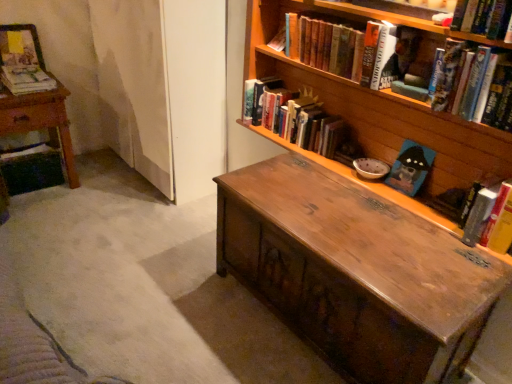
Question: Considering the positions of matte paper magazine at upper left, the 1th book from the left, and matte paper book at left, which appears as the 2th book when viewed from the left, in the image, is matte paper magazine at upper left, the 1th book from the left, bigger or smaller than matte paper book at left, which appears as the 2th book when viewed from the left,?

Choices:
 (A) big
 (B) small

Answer: (A)

Question: Does point (30, 64) appear closer or farther from the camera than point (51, 79)?

Choices:
 (A) closer
 (B) farther

Answer: (B)

Question: Based on their relative distances, which object is farther from the matte paper book at left, the 6th book when ordered from right to left?

Choices:
 (A) wooden bookcase at upper right
 (B) hardcover book at right, the seventh book in the left-to-right sequence
 (C) hardcover book at upper right, arranged as the sixth book when viewed from the left
 (D) matte paper magazine at upper left, which is counted as the seventh book, starting from the right
 (E) wooden table at left

Answer: (B)

Question: Estimate the real-world distances between objects in this image. Which object is closer to the hardcover book at center, placed as the fifth book when sorted from right to left?

Choices:
 (A) hardcover book at right, which is counted as the first book, starting from the right
 (B) matte paper book at left, the 6th book when ordered from right to left
 (C) matte paper magazine at upper left, the 1th book from the left
 (D) wooden table at left
 (E) hardcover book at upper right, arranged as the sixth book when viewed from the left

Answer: (E)